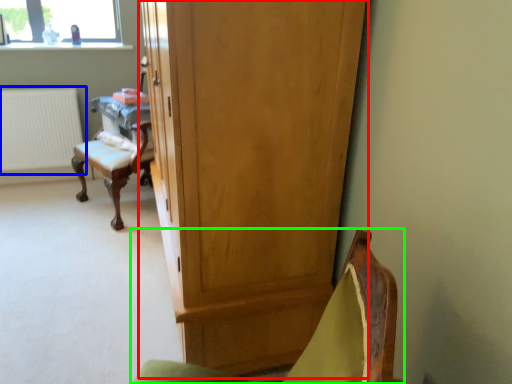
Question: Which object is positioned closest to cupboard (highlighted by a red box)? Select from radiator (highlighted by a blue box) and chair (highlighted by a green box).

Choices:
 (A) radiator
 (B) chair

Answer: (B)